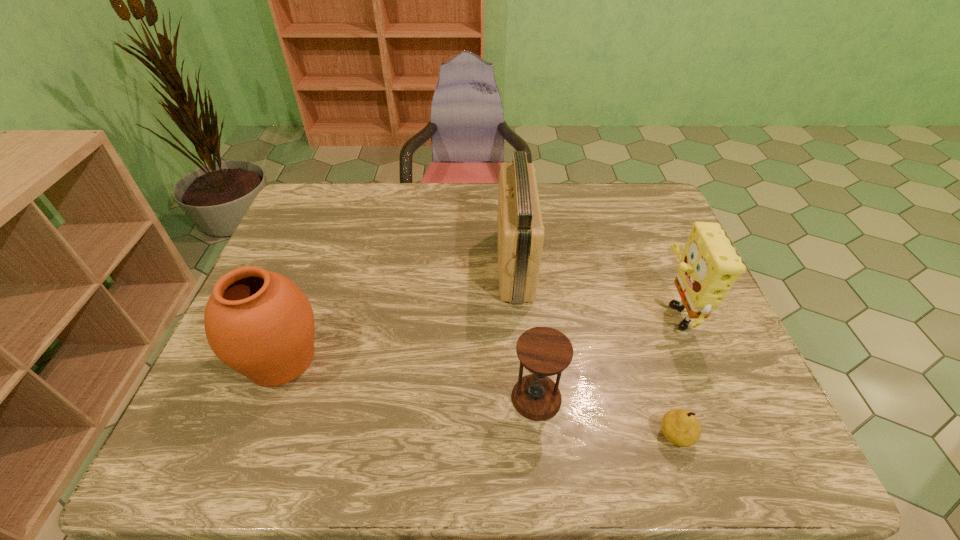
Locate an element on the screen. This screenshot has height=540, width=960. radio receiver is located at coordinates (520, 229).

The height and width of the screenshot is (540, 960). Identify the location of urn. (259, 323).

Find the location of a particular element. This screenshot has width=960, height=540. the rightmost object is located at coordinates (709, 265).

The image size is (960, 540). In order to click on hourglass in this screenshot , I will do `click(543, 351)`.

Identify the location of pear. Image resolution: width=960 pixels, height=540 pixels. (680, 427).

At what (x,y) coordinates should I click in order to perform the action: click on the shortest object. Please return your answer as a coordinate pair (x, y). Looking at the image, I should click on (680, 427).

Where is `vacant space located 0.060m on the front-facing side of the radio receiver`? Image resolution: width=960 pixels, height=540 pixels. vacant space located 0.060m on the front-facing side of the radio receiver is located at coordinates (476, 265).

This screenshot has height=540, width=960. I want to click on blank area located 0.220m on the front-facing side of the radio receiver, so click(x=420, y=265).

You are a GUI agent. You are given a task and a screenshot of the screen. Output one action in this format:
    pyautogui.click(x=<x>, y=<y>)
    Task: Click on the vacant area located on the front-facing side of the radio receiver
    The width and height of the screenshot is (960, 540).
    Given the screenshot: What is the action you would take?
    pyautogui.click(x=452, y=265)

You are a GUI agent. You are given a task and a screenshot of the screen. Output one action in this format:
    pyautogui.click(x=<x>, y=<y>)
    Task: Click on the free location located on the right of the urn
    This screenshot has height=540, width=960.
    Given the screenshot: What is the action you would take?
    pyautogui.click(x=448, y=359)